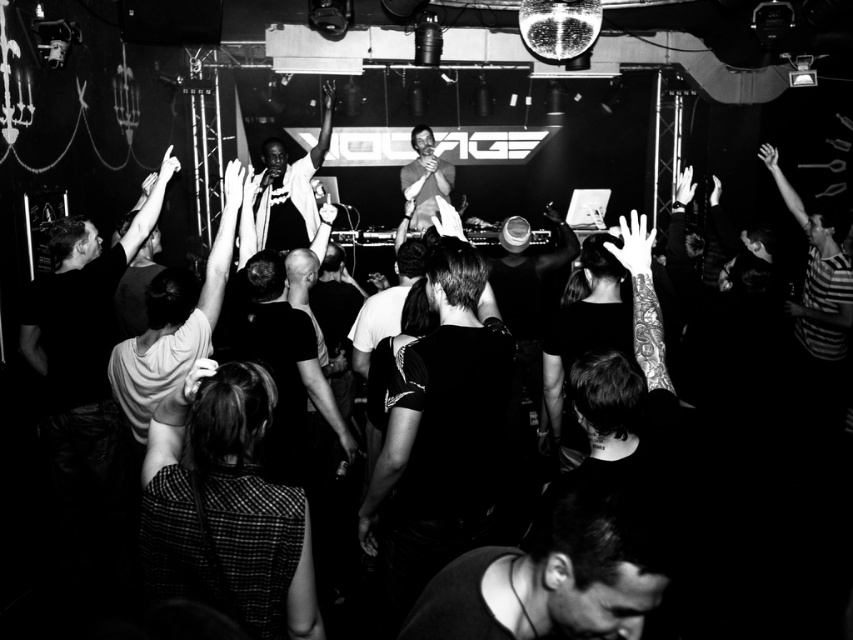
Who is more distant from viewer, (154,362) or (288,202)?

The point (288,202) is behind.

Does smooth black shirt at center have a greater width compared to white matte shirt at center?

No.

Does point (122, 381) lie behind point (331, 124)?

No, it is not.

Find the location of a particular element. This screenshot has width=853, height=640. smooth black shirt at center is located at coordinates (175, 323).

Which is below, dark fabric shirt at lower center or white matte shirt at center?

Positioned lower is dark fabric shirt at lower center.

Between dark fabric shirt at lower center and white matte shirt at center, which one is positioned higher?

white matte shirt at center is higher up.

I want to click on dark fabric shirt at lower center, so click(556, 572).

Identify the location of dark fabric shirt at lower center. The height and width of the screenshot is (640, 853). (556, 572).

Which is above, dark fabric shirt at lower center or smooth skin at center?

smooth skin at center is higher up.

Is dark fabric shirt at lower center bigger than smooth skin at center?

No.

Find the location of a particular element. dark fabric shirt at lower center is located at coordinates (556, 572).

This screenshot has height=640, width=853. What are the coordinates of `dark fabric shirt at lower center` in the screenshot? It's located at (556, 572).